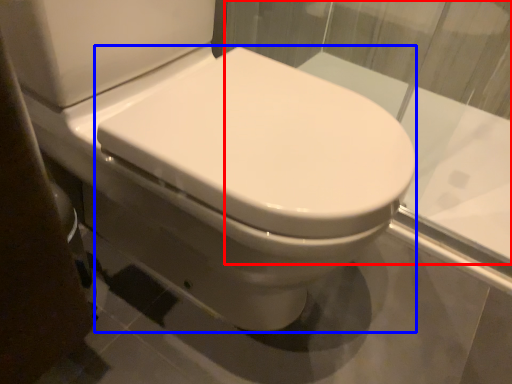
Question: Among these objects, which one is nearest to the camera, glass window (highlighted by a red box) or bidet (highlighted by a blue box)?

Choices:
 (A) glass window
 (B) bidet

Answer: (B)